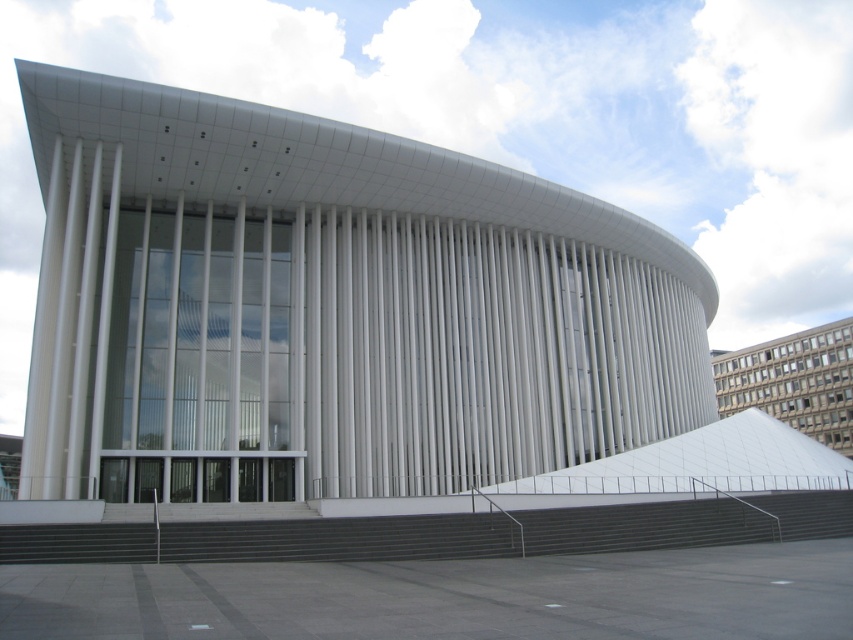
Question: Does dark gray concrete stairs at lower center have a lesser width compared to white glass building at upper right?

Choices:
 (A) no
 (B) yes

Answer: (A)

Question: Among these objects, which one is nearest to the camera?

Choices:
 (A) dark gray concrete stairs at lower center
 (B) white glass building at upper right

Answer: (A)

Question: Can you confirm if white smooth building at center is positioned above white glass building at upper right?

Choices:
 (A) yes
 (B) no

Answer: (A)

Question: Which is nearer to the dark gray concrete stairs at lower center?

Choices:
 (A) white smooth building at center
 (B) white glass building at upper right

Answer: (A)

Question: Considering the relative positions of dark gray concrete stairs at lower center and white glass building at upper right in the image provided, where is dark gray concrete stairs at lower center located with respect to white glass building at upper right?

Choices:
 (A) left
 (B) right

Answer: (A)

Question: Considering the real-world distances, which object is closest to the dark gray concrete stairs at lower center?

Choices:
 (A) white smooth building at center
 (B) white glass building at upper right

Answer: (A)